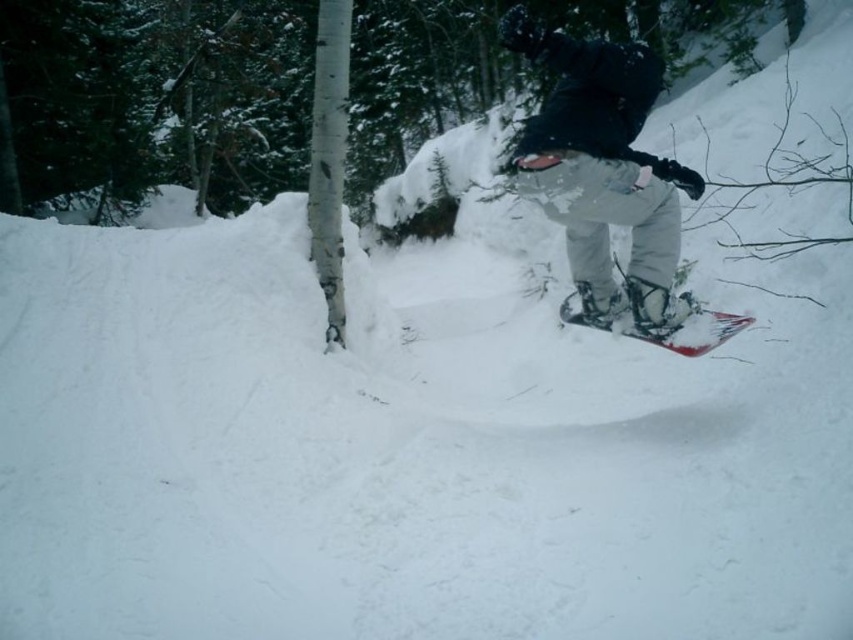
Looking at this image, you are a photographer trying to capture the snowboarder with both the matte black snowboard at center and the red plastic snowboard at center in the frame. Since the snowboarder is moving quickly, you need to focus on the larger object first. Which snowboard should you prioritize focusing on?

The matte black snowboard at center is larger in size than the red plastic snowboard at center, so you should prioritize focusing on the matte black snowboard at center first.

You are a snowboarder trying to place your snowboards in a storage rack that can only hold items spaced 2 feet apart. Given the distance between the matte black snowboard at center and the red plastic snowboard at center, will they both fit in the rack?

The distance between the matte black snowboard at center and the red plastic snowboard at center is 27.30 inches, which is 2.275 feet. Since the rack requires at least 2 feet between items, they can fit with some extra space remaining.

You are a snowboarder navigating through the forest and need to determine your position relative to two points marked in the image. Which point is closer to you, point (634, 324) or point (717, 324)?

Point (634, 324) is closer to you because it is further to the viewer than point (717, 324).